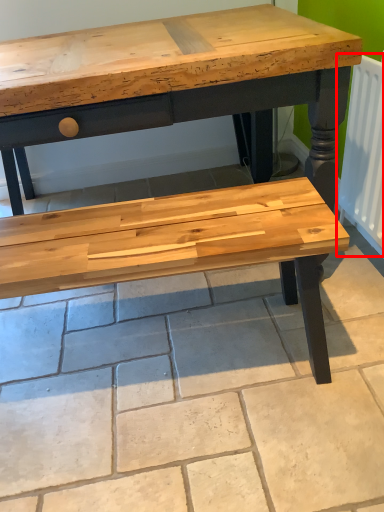
Question: From the image's perspective, considering the relative positions of radiator (annotated by the red box) and tile in the image provided, where is radiator (annotated by the red box) located with respect to the staircase?

Choices:
 (A) above
 (B) below

Answer: (A)